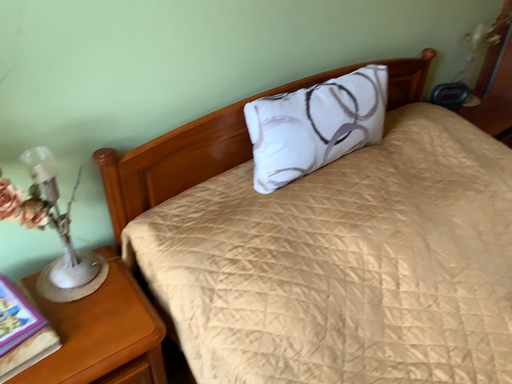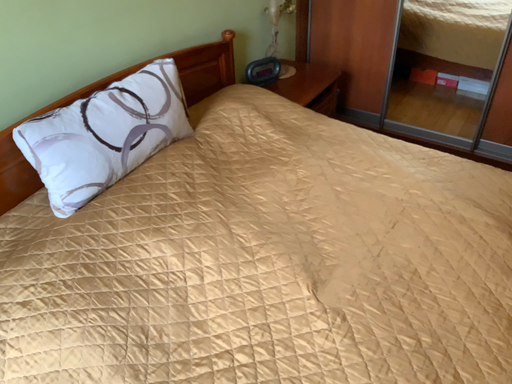
Question: Which way did the camera rotate in the video?

Choices:
 (A) rotated left
 (B) rotated right

Answer: (B)